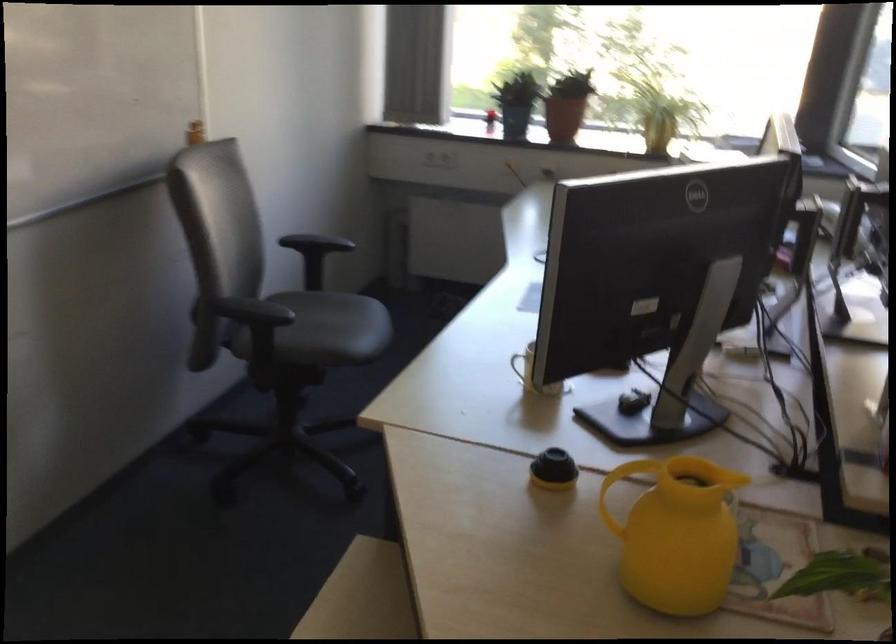
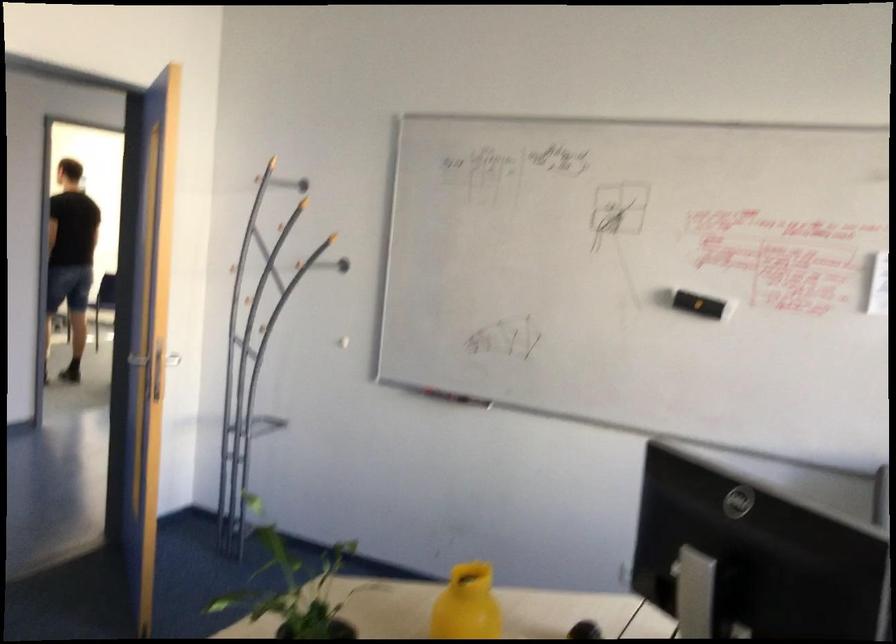
The point at (x=613, y=514) is marked in the first image. Where is the corresponding point in the second image?

(467, 605)